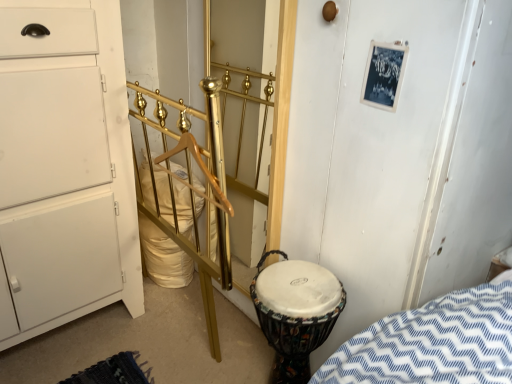
In order to face multicolored fabric drum at lower right, should I rotate leftwards or rightwards?

Turn right by 4.555 degrees to look at multicolored fabric drum at lower right.

Identify the location of white matte chest of drawers at left. (64, 168).

Where is `gold polished metal rail at center`? This screenshot has height=384, width=512. gold polished metal rail at center is located at coordinates (192, 188).

Is gold metallic door at center oriented towards multicolored fabric drum at lower right?

No, gold metallic door at center does not turn towards multicolored fabric drum at lower right.

Which of these two, gold metallic door at center or multicolored fabric drum at lower right, stands shorter?

multicolored fabric drum at lower right is shorter.

From a real-world perspective, who is located higher, gold metallic door at center or multicolored fabric drum at lower right?

gold metallic door at center is physically above.

From the image's perspective, does gold metallic door at center appear lower than multicolored fabric drum at lower right?

Actually, gold metallic door at center appears above multicolored fabric drum at lower right in the image.

Is white matte chest of drawers at left facing towards gold polished metal rail at center?

Yes, white matte chest of drawers at left faces towards gold polished metal rail at center.

Does white matte chest of drawers at left come in front of gold polished metal rail at center?

No, it is behind gold polished metal rail at center.

Can you confirm if white matte chest of drawers at left is positioned to the left of gold polished metal rail at center?

Indeed, white matte chest of drawers at left is positioned on the left side of gold polished metal rail at center.

Between white matte chest of drawers at left and gold polished metal rail at center, which one has smaller size?

Smaller between the two is gold polished metal rail at center.

From the image's perspective, which one is positioned lower, white matte chest of drawers at left or gold metallic door at center?

white matte chest of drawers at left.

Where is `the chest of drawers below the gold metallic door at center (from the image's perspective)`? This screenshot has height=384, width=512. the chest of drawers below the gold metallic door at center (from the image's perspective) is located at coordinates (64, 168).

Does white matte chest of drawers at left lie behind gold metallic door at center?

No.

Is white matte chest of drawers at left placed right next to gold metallic door at center?

No.

Measure the distance between gold polished metal rail at center and multicolored fabric drum at lower right.

gold polished metal rail at center and multicolored fabric drum at lower right are 12.90 inches apart from each other.

From a real-world perspective, between gold polished metal rail at center and multicolored fabric drum at lower right, who is vertically higher?

gold polished metal rail at center is physically above.

Which object is further away from the camera taking this photo, gold polished metal rail at center or multicolored fabric drum at lower right?

multicolored fabric drum at lower right is behind.

Between gold polished metal rail at center and multicolored fabric drum at lower right, which one has smaller size?

Smaller between the two is multicolored fabric drum at lower right.

Based on the photo, which of these two, gold polished metal rail at center or gold metallic door at center, is wider?

gold polished metal rail at center.

From the picture: From a real-world perspective, is gold polished metal rail at center positioned under gold metallic door at center based on gravity?

Yes.

Considering the relative positions of gold polished metal rail at center and gold metallic door at center in the image provided, is gold polished metal rail at center behind gold metallic door at center?

No, gold polished metal rail at center is closer to the camera.

Is gold polished metal rail at center far from gold metallic door at center?

No, there isn't a large distance between gold polished metal rail at center and gold metallic door at center.

Does gold metallic door at center come behind white matte chest of drawers at left?

Yes, it is behind white matte chest of drawers at left.

Is point (215, 51) closer to viewer compared to point (11, 326)?

No, (215, 51) is further to viewer.

Can you confirm if gold metallic door at center is wider than white matte chest of drawers at left?

Answer: No.

Is multicolored fabric drum at lower right with white matte chest of drawers at left?

No, multicolored fabric drum at lower right is not touching white matte chest of drawers at left.

From the image's perspective, which one is positioned lower, multicolored fabric drum at lower right or white matte chest of drawers at left?

multicolored fabric drum at lower right appears lower in the image.

Measure the distance between multicolored fabric drum at lower right and white matte chest of drawers at left.

27.86 inches.

Considering the relative sizes of multicolored fabric drum at lower right and white matte chest of drawers at left in the image provided, is multicolored fabric drum at lower right shorter than white matte chest of drawers at left?

Indeed, multicolored fabric drum at lower right has a lesser height compared to white matte chest of drawers at left.

You are a GUI agent. You are given a task and a screenshot of the screen. Output one action in this format:
    pyautogui.click(x=<x>, y=<y>)
    Task: Click on the drum directly beneath the gold metallic door at center (from a real-world perspective)
    This screenshot has height=384, width=512.
    Given the screenshot: What is the action you would take?
    pyautogui.click(x=296, y=311)

Where is `rail that is in front of the white matte chest of drawers at left`? This screenshot has width=512, height=384. rail that is in front of the white matte chest of drawers at left is located at coordinates pyautogui.click(x=192, y=188).

Based on the photo, looking at the image, which one is located further to multicolored fabric drum at lower right, gold polished metal rail at center or gold metallic door at center?

Among the two, gold metallic door at center is located further to multicolored fabric drum at lower right.

Considering their positions, is multicolored fabric drum at lower right positioned closer to gold metallic door at center than gold polished metal rail at center?

The object closer to gold metallic door at center is gold polished metal rail at center.

From the image, which object appears to be nearer to gold polished metal rail at center, multicolored fabric drum at lower right or gold metallic door at center?

Among the two, multicolored fabric drum at lower right is located nearer to gold polished metal rail at center.

Based on the photo, considering their positions, is white matte chest of drawers at left positioned closer to gold metallic door at center than multicolored fabric drum at lower right?

Based on the image, multicolored fabric drum at lower right appears to be nearer to gold metallic door at center.

Considering their positions, is multicolored fabric drum at lower right positioned closer to white matte chest of drawers at left than gold metallic door at center?

gold metallic door at center lies closer to white matte chest of drawers at left than the other object.

Considering their positions, is white matte chest of drawers at left positioned further to multicolored fabric drum at lower right than gold polished metal rail at center?

white matte chest of drawers at left is further to multicolored fabric drum at lower right.

Based on their spatial positions, is gold metallic door at center or white matte chest of drawers at left further from multicolored fabric drum at lower right?

white matte chest of drawers at left is further to multicolored fabric drum at lower right.

Based on their spatial positions, is gold metallic door at center or white matte chest of drawers at left closer to gold polished metal rail at center?

white matte chest of drawers at left is closer to gold polished metal rail at center.

Find the location of a particular element. The height and width of the screenshot is (384, 512). rail between white matte chest of drawers at left and gold metallic door at center is located at coordinates (192, 188).

Image resolution: width=512 pixels, height=384 pixels. I want to click on door located between white matte chest of drawers at left and multicolored fabric drum at lower right in the left-right direction, so click(245, 111).

Where is `rail between white matte chest of drawers at left and multicolored fabric drum at lower right from left to right`? rail between white matte chest of drawers at left and multicolored fabric drum at lower right from left to right is located at coordinates (192, 188).

In order to click on rail between gold metallic door at center and multicolored fabric drum at lower right in the vertical direction in this screenshot , I will do `click(192, 188)`.